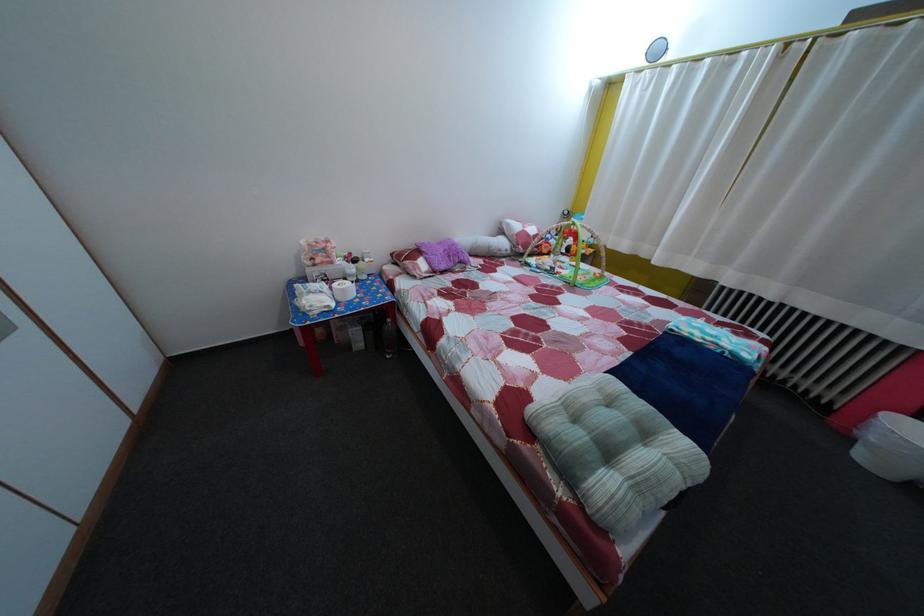
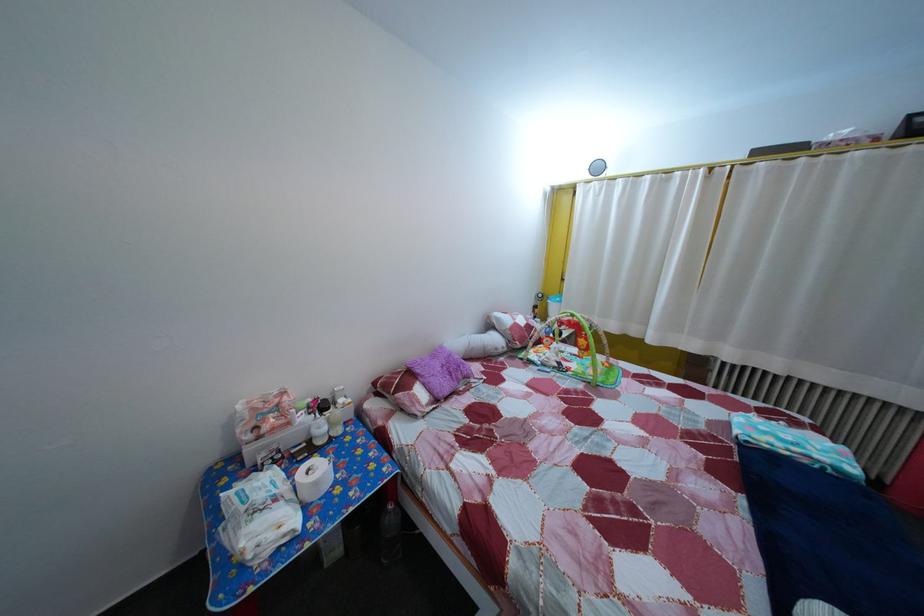
Where in the second image is the point corresponding to point 718,69 from the first image?

(659, 185)